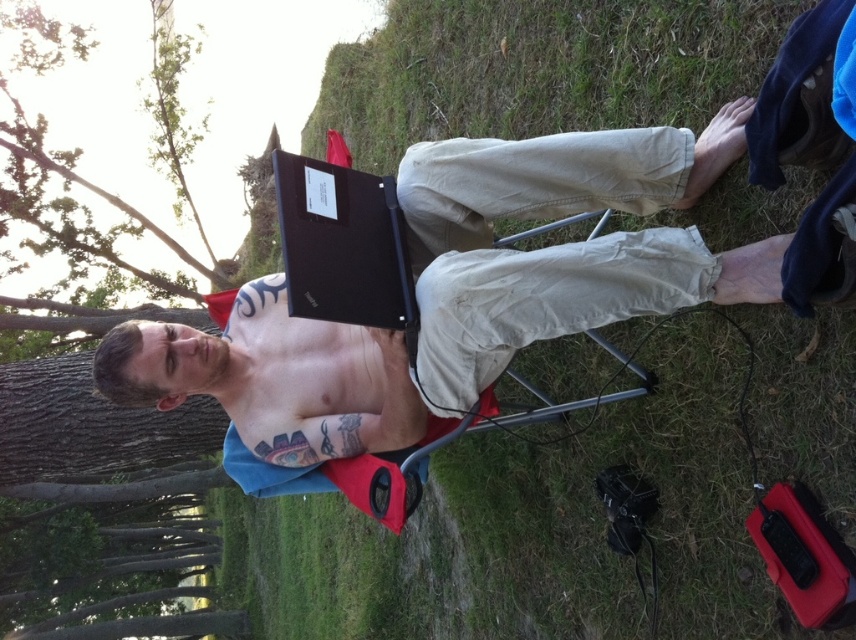
You are a photographer trying to capture both the shiny black laptop at center and the black matte laptop at center in a single frame. The minimum distance between the two laptops that your camera can focus on is 12 inches. Can you fit both laptops into the frame without any issues?

The shiny black laptop at center is 13.34 inches away from the black matte laptop at center, which exceeds the camera minimum focusing distance of 12 inches. Therefore, both laptops can be captured in the frame without issues.

You are standing in the park and see two points marked in the image. Which point is closer to you, point (x=260, y=412) or point (x=328, y=209)?

Point (x=260, y=412) is further to the viewer than point (x=328, y=209), so point (x=328, y=209) is closer to you.

You are a photographer aiming to capture the perfect shot of the matte black laptop at center. To ensure the best lighting, you need to position yourself directly in front of the laptop. Based on its current position at point coordinates, where should you stand relative to the laptop?

Since the matte black laptop at center is positioned at coordinates point [458,291], you should stand directly in front of it along the same horizontal plane to achieve optimal lighting.